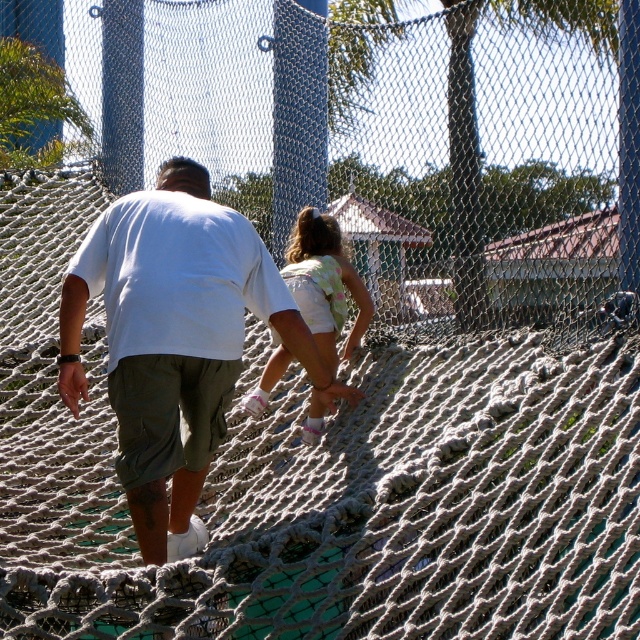
You are a photographer trying to capture a photo of both the white cotton shirt at center and the light pink fabric dress at center in the playground scene. Since you want both subjects to be clearly visible, which clothing item should you focus on first to ensure proper focus, considering their sizes?

The white cotton shirt at center has a greater height compared to the light pink fabric dress at center, so focusing on the white cotton shirt at center first would ensure proper focus due to its larger size.